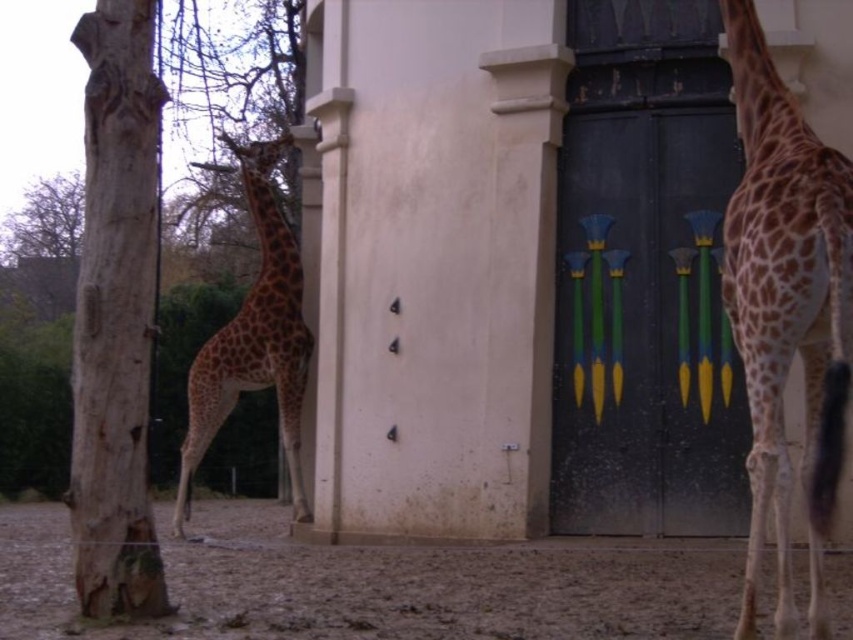
Question: Among these points, which one is farthest from the camera?

Choices:
 (A) (772, 83)
 (B) (99, 298)

Answer: (B)

Question: Considering the relative positions of smooth wood tree trunk at left and spotted fur giraffe at center in the image provided, where is smooth wood tree trunk at left located with respect to spotted fur giraffe at center?

Choices:
 (A) below
 (B) above

Answer: (B)

Question: Does spotted brown giraffe at right appear over smooth wood tree trunk at left?

Choices:
 (A) yes
 (B) no

Answer: (A)

Question: Does smooth wood tree trunk at left lie behind spotted fur giraffe at center?

Choices:
 (A) yes
 (B) no

Answer: (B)

Question: Which point is farther from the camera taking this photo?

Choices:
 (A) (131, 272)
 (B) (247, 188)
 (C) (753, 252)

Answer: (B)

Question: Which point is closer to the camera?

Choices:
 (A) smooth wood tree trunk at left
 (B) spotted brown giraffe at right

Answer: (B)